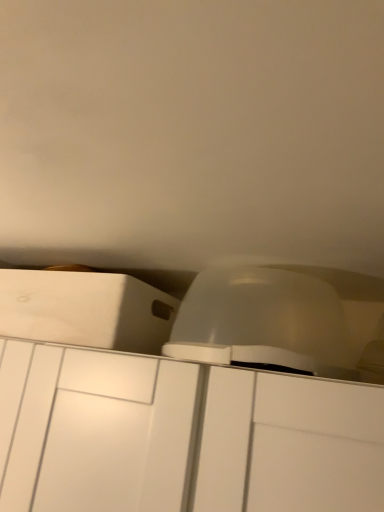
This screenshot has height=512, width=384. What do you see at coordinates (181, 436) in the screenshot?
I see `white matte cabinet at center, which appears as the 1th cabinetry when ordered from the bottom` at bounding box center [181, 436].

What are the coordinates of `white matte cabinet at upper left, acting as the 2th cabinetry starting from the bottom` in the screenshot? It's located at (85, 309).

From a real-world perspective, is white matte cabinet at upper left, acting as the 2th cabinetry starting from the bottom, positioned above or below white matte cabinet at center, the second cabinetry when ordered from top to bottom?

Clearly, from a real-world perspective, white matte cabinet at upper left, acting as the 2th cabinetry starting from the bottom, is above white matte cabinet at center, the second cabinetry when ordered from top to bottom.

How many degrees apart are the facing directions of white matte cabinet at upper left, the 1th cabinetry when ordered from top to bottom, and white matte cabinet at center, the second cabinetry when ordered from top to bottom?

The angle between the facing direction of white matte cabinet at upper left, the 1th cabinetry when ordered from top to bottom, and the facing direction of white matte cabinet at center, the second cabinetry when ordered from top to bottom, is 0.000677 degrees.

Which object is further away from the camera taking this photo, white matte cabinet at upper left, the 1th cabinetry when ordered from top to bottom, or white matte cabinet at center, which appears as the 1th cabinetry when ordered from the bottom?

white matte cabinet at upper left, the 1th cabinetry when ordered from top to bottom, is more distant.

Which of these two, white matte cabinet at upper left, acting as the 2th cabinetry starting from the bottom, or white matte cabinet at center, the second cabinetry when ordered from top to bottom, stands shorter?

white matte cabinet at upper left, acting as the 2th cabinetry starting from the bottom.

From a real-world perspective, between white matte cabinet at center, the second cabinetry when ordered from top to bottom, and transparent plastic dome at center, who is vertically lower?

white matte cabinet at center, the second cabinetry when ordered from top to bottom, is physically lower.

Is white matte cabinet at center, which appears as the 1th cabinetry when ordered from the bottom, situated inside transparent plastic dome at center or outside?

white matte cabinet at center, which appears as the 1th cabinetry when ordered from the bottom, is spatially situated outside transparent plastic dome at center.

Is white matte cabinet at center, the second cabinetry when ordered from top to bottom, looking in the opposite direction of transparent plastic dome at center?

white matte cabinet at center, the second cabinetry when ordered from top to bottom, is not turned away from transparent plastic dome at center.

Who is more distant, white matte cabinet at center, which appears as the 1th cabinetry when ordered from the bottom, or transparent plastic dome at center?

Positioned behind is transparent plastic dome at center.

Which is correct: white matte cabinet at upper left, acting as the 2th cabinetry starting from the bottom, is inside transparent plastic dome at center, or outside of it?

white matte cabinet at upper left, acting as the 2th cabinetry starting from the bottom, is not inside transparent plastic dome at center, it's outside.

From the image's perspective, which is below, white matte cabinet at upper left, the 1th cabinetry when ordered from top to bottom, or transparent plastic dome at center?

white matte cabinet at upper left, the 1th cabinetry when ordered from top to bottom, is shown below in the image.

Is white matte cabinet at upper left, acting as the 2th cabinetry starting from the bottom, positioned with its back to transparent plastic dome at center?

No, white matte cabinet at upper left, acting as the 2th cabinetry starting from the bottom, is not facing the opposite direction of transparent plastic dome at center.

Can you confirm if white matte cabinet at upper left, the 1th cabinetry when ordered from top to bottom, is smaller than transparent plastic dome at center?

Incorrect, white matte cabinet at upper left, the 1th cabinetry when ordered from top to bottom, is not smaller in size than transparent plastic dome at center.

Consider the image. Is transparent plastic dome at center inside or outside of white matte cabinet at center, the second cabinetry when ordered from top to bottom?

transparent plastic dome at center is located beyond the bounds of white matte cabinet at center, the second cabinetry when ordered from top to bottom.

How distant is transparent plastic dome at center from white matte cabinet at center, which appears as the 1th cabinetry when ordered from the bottom?

transparent plastic dome at center and white matte cabinet at center, which appears as the 1th cabinetry when ordered from the bottom, are 7.99 inches apart.

Considering the relative positions of transparent plastic dome at center and white matte cabinet at center, the second cabinetry when ordered from top to bottom, in the image provided, is transparent plastic dome at center to the right of white matte cabinet at center, the second cabinetry when ordered from top to bottom, from the viewer's perspective?

Yes.

Which point is more forward, (190,335) or (14,384)?

The point (14,384) is closer.

At what (x,y) coordinates should I click in order to perform the action: click on cabinetry that is below the white matte cabinet at upper left, acting as the 2th cabinetry starting from the bottom (from the image's perspective). Please return your answer as a coordinate pair (x, y). Image resolution: width=384 pixels, height=512 pixels. Looking at the image, I should click on (181, 436).

Which object is further away from the camera taking this photo, white matte cabinet at center, the second cabinetry when ordered from top to bottom, or white matte cabinet at upper left, the 1th cabinetry when ordered from top to bottom?

white matte cabinet at upper left, the 1th cabinetry when ordered from top to bottom.

In the scene shown: Considering the sizes of white matte cabinet at center, the second cabinetry when ordered from top to bottom, and white matte cabinet at upper left, the 1th cabinetry when ordered from top to bottom, in the image, is white matte cabinet at center, the second cabinetry when ordered from top to bottom, bigger or smaller than white matte cabinet at upper left, the 1th cabinetry when ordered from top to bottom,?

In the image, white matte cabinet at center, the second cabinetry when ordered from top to bottom, appears to be larger than white matte cabinet at upper left, the 1th cabinetry when ordered from top to bottom.

Is white matte cabinet at upper left, the 1th cabinetry when ordered from top to bottom, at the back of white matte cabinet at center, which appears as the 1th cabinetry when ordered from the bottom?

No, white matte cabinet at center, which appears as the 1th cabinetry when ordered from the bottom, is not facing the opposite direction of white matte cabinet at upper left, the 1th cabinetry when ordered from top to bottom.

Is transparent plastic dome at center inside the boundaries of white matte cabinet at upper left, acting as the 2th cabinetry starting from the bottom, or outside?

transparent plastic dome at center is located beyond the bounds of white matte cabinet at upper left, acting as the 2th cabinetry starting from the bottom.

Looking at this image, from a real-world perspective, between transparent plastic dome at center and white matte cabinet at upper left, acting as the 2th cabinetry starting from the bottom, who is vertically higher?

transparent plastic dome at center.

Are transparent plastic dome at center and white matte cabinet at upper left, acting as the 2th cabinetry starting from the bottom, beside each other?

No, transparent plastic dome at center is not beside white matte cabinet at upper left, acting as the 2th cabinetry starting from the bottom.

Which object is wider, transparent plastic dome at center or white matte cabinet at upper left, the 1th cabinetry when ordered from top to bottom?

white matte cabinet at upper left, the 1th cabinetry when ordered from top to bottom, is wider.

Find the location of `cabinetry below the white matte cabinet at upper left, acting as the 2th cabinetry starting from the bottom (from the image's perspective)`. cabinetry below the white matte cabinet at upper left, acting as the 2th cabinetry starting from the bottom (from the image's perspective) is located at coordinates (181, 436).

Locate an element on the screen. This screenshot has height=512, width=384. lift behind the white matte cabinet at center, the second cabinetry when ordered from top to bottom is located at coordinates (262, 322).

When comparing their distances from transparent plastic dome at center, does white matte cabinet at center, which appears as the 1th cabinetry when ordered from the bottom, or white matte cabinet at upper left, acting as the 2th cabinetry starting from the bottom, seem closer?

Based on the image, white matte cabinet at upper left, acting as the 2th cabinetry starting from the bottom, appears to be nearer to transparent plastic dome at center.

From the image, which object appears to be farther from white matte cabinet at center, which appears as the 1th cabinetry when ordered from the bottom, transparent plastic dome at center or white matte cabinet at upper left, acting as the 2th cabinetry starting from the bottom?

Among the two, transparent plastic dome at center is located further to white matte cabinet at center, which appears as the 1th cabinetry when ordered from the bottom.

From the image, which object appears to be nearer to white matte cabinet at upper left, acting as the 2th cabinetry starting from the bottom, transparent plastic dome at center or white matte cabinet at center, the second cabinetry when ordered from top to bottom?

Among the two, white matte cabinet at center, the second cabinetry when ordered from top to bottom, is located nearer to white matte cabinet at upper left, acting as the 2th cabinetry starting from the bottom.

Considering their positions, is white matte cabinet at upper left, the 1th cabinetry when ordered from top to bottom, positioned closer to transparent plastic dome at center than white matte cabinet at center, the second cabinetry when ordered from top to bottom?

white matte cabinet at upper left, the 1th cabinetry when ordered from top to bottom, lies closer to transparent plastic dome at center than the other object.

Which object lies nearer to the anchor point white matte cabinet at center, which appears as the 1th cabinetry when ordered from the bottom, white matte cabinet at upper left, the 1th cabinetry when ordered from top to bottom, or transparent plastic dome at center?

white matte cabinet at upper left, the 1th cabinetry when ordered from top to bottom, is closer to white matte cabinet at center, which appears as the 1th cabinetry when ordered from the bottom.

From the image, which object appears to be farther from white matte cabinet at upper left, the 1th cabinetry when ordered from top to bottom, white matte cabinet at center, the second cabinetry when ordered from top to bottom, or transparent plastic dome at center?

transparent plastic dome at center is positioned further to the anchor white matte cabinet at upper left, the 1th cabinetry when ordered from top to bottom.

This screenshot has width=384, height=512. In order to click on cabinetry situated between white matte cabinet at upper left, the 1th cabinetry when ordered from top to bottom, and transparent plastic dome at center from left to right in this screenshot , I will do `click(181, 436)`.